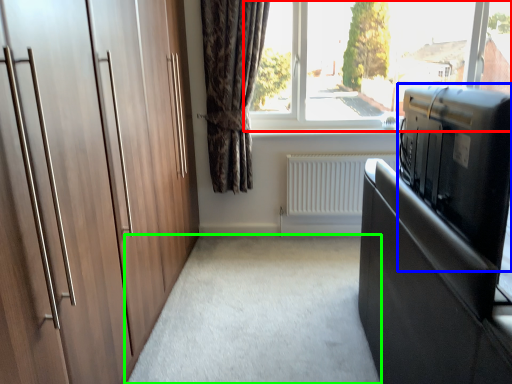
Question: Based on their relative distances, which object is nearer to window (highlighted by a red box)? Choose from appliance (highlighted by a blue box) and plain (highlighted by a green box).

Choices:
 (A) appliance
 (B) plain

Answer: (B)